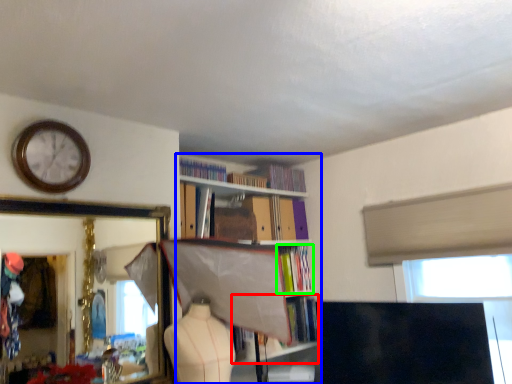
Question: Estimate the real-world distances between objects in this image. Which object is closer to book (highlighted by a red box), bookcase (highlighted by a blue box) or book (highlighted by a green box)?

Choices:
 (A) bookcase
 (B) book

Answer: (B)